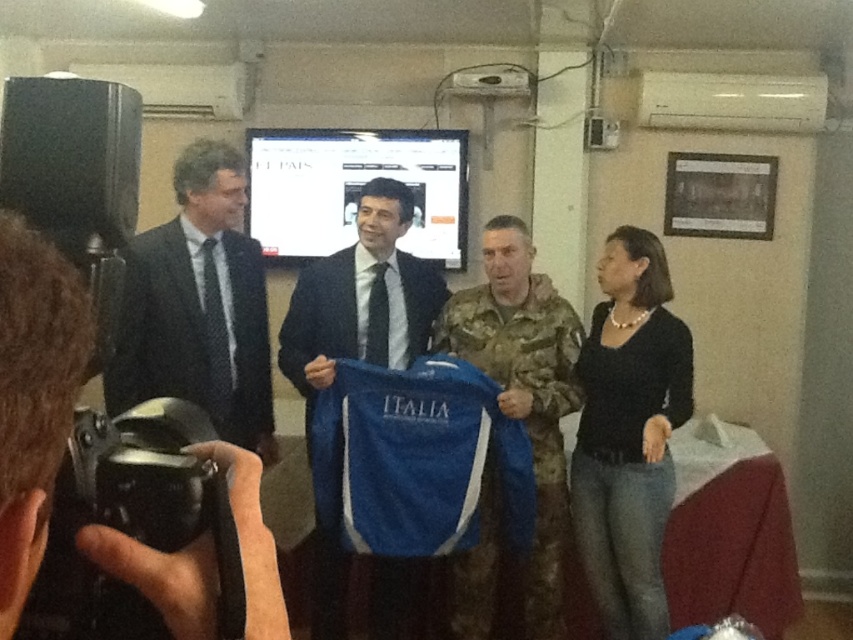
How distant is black jersey at right from black plastic video camera at lower left?

They are 2.20 meters apart.

Is black jersey at right taller than black plastic video camera at lower left?

Correct, black jersey at right is much taller as black plastic video camera at lower left.

Where is `black jersey at right`? black jersey at right is located at coordinates (630, 433).

Does black jersey at right have a greater width compared to matte black suit at center?

Indeed, black jersey at right has a greater width compared to matte black suit at center.

Is black jersey at right positioned behind matte black suit at center?

Yes, black jersey at right is further from the viewer.

Does point (659, 456) come closer to viewer compared to point (4, 620)?

No, it is behind (4, 620).

This screenshot has height=640, width=853. Identify the location of black jersey at right. (630, 433).

Which is below, black plastic video camera at lower left or camouflagetextured fabric at center?

camouflagetextured fabric at center is below.

Is black plastic video camera at lower left bigger than camouflagetextured fabric at center?

Actually, black plastic video camera at lower left might be smaller than camouflagetextured fabric at center.

Find the location of a particular element. This screenshot has height=640, width=853. black plastic video camera at lower left is located at coordinates (132, 522).